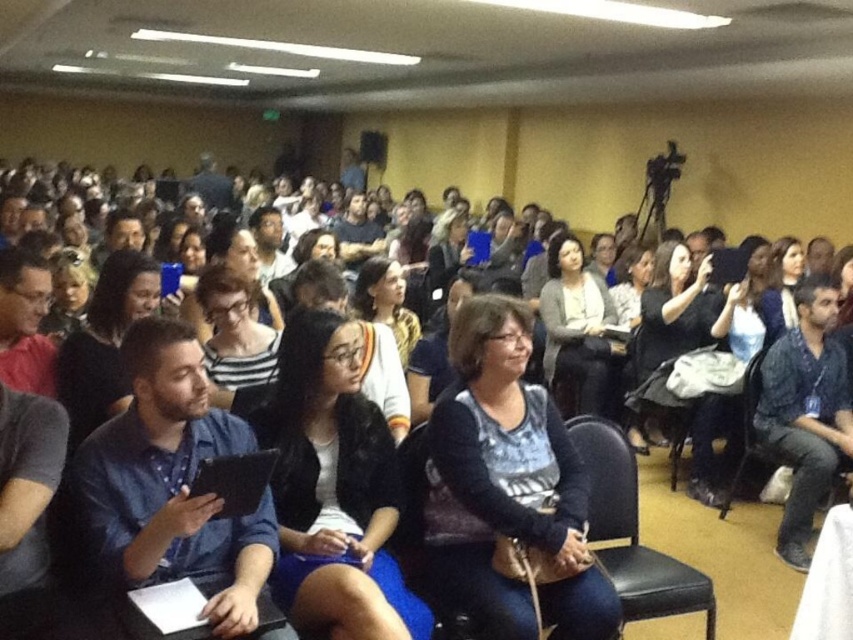
Can you confirm if dark blue shirt at center is bigger than black leather chair at right?

Actually, dark blue shirt at center might be smaller than black leather chair at right.

Where is `dark blue shirt at center`? This screenshot has width=853, height=640. dark blue shirt at center is located at coordinates (103, 342).

Which of these two, striped shirt at center or black leather chair at lower right, stands shorter?

striped shirt at center

Can you confirm if striped shirt at center is positioned to the right of black leather chair at lower right?

Incorrect, striped shirt at center is not on the right side of black leather chair at lower right.

Which is behind, point (216, 288) or point (747, 426)?

Point (747, 426)

Find the location of `striped shirt at center`. striped shirt at center is located at coordinates (233, 337).

Consider the image. Which of these two, blue denim shirt at right or matte black shirt at left, stands taller?

Standing taller between the two is blue denim shirt at right.

Does blue denim shirt at right have a greater height compared to matte black shirt at left?

Indeed, blue denim shirt at right has a greater height compared to matte black shirt at left.

Describe the element at coordinates (805, 412) in the screenshot. I see `blue denim shirt at right` at that location.

Where is `blue denim shirt at right`? The image size is (853, 640). blue denim shirt at right is located at coordinates (805, 412).